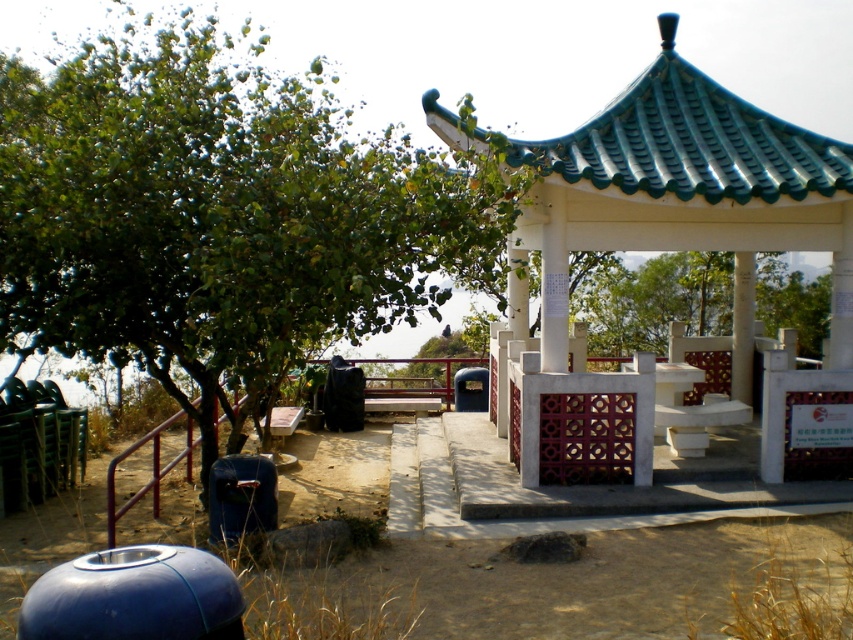
Who is more forward, (106, 70) or (659, 202)?

Point (659, 202) is in front.

Can you confirm if green leafy tree at upper left is positioned below white glossy pavilion at center?

Incorrect, green leafy tree at upper left is not positioned below white glossy pavilion at center.

Who is more forward, (305, 192) or (749, 368)?

Positioned in front is point (305, 192).

I want to click on green leafy tree at upper left, so click(218, 216).